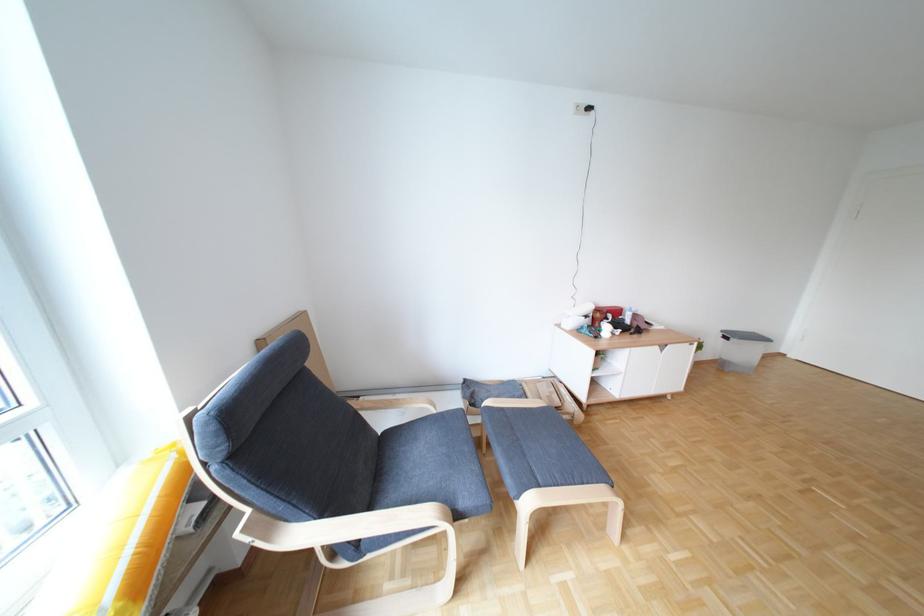
Where is `chair sitting surface`? Image resolution: width=924 pixels, height=616 pixels. chair sitting surface is located at coordinates (429, 464).